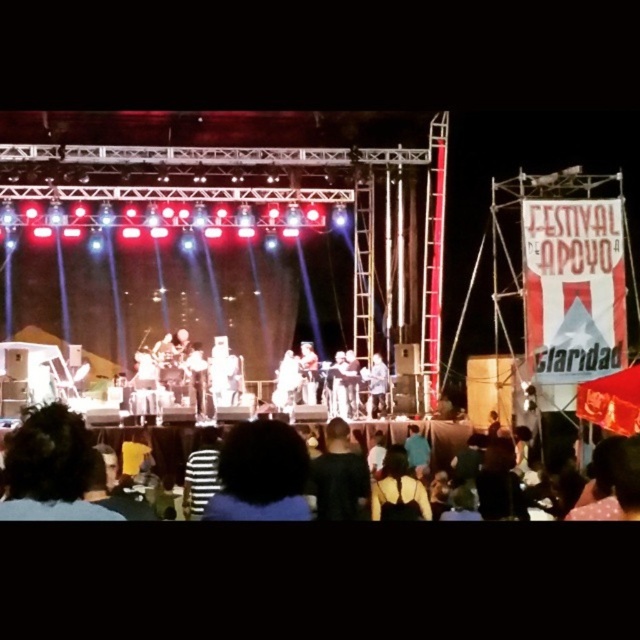
Question: Considering the relative positions of smooth skin person at center and light brown wooden guitar at center in the image provided, where is smooth skin person at center located with respect to light brown wooden guitar at center?

Choices:
 (A) left
 (B) right

Answer: (A)

Question: Can you confirm if dark hair at center is bigger than dark brown leather jacket at center?

Choices:
 (A) no
 (B) yes

Answer: (B)

Question: Does dark hair at center have a smaller size compared to white fabric at center?

Choices:
 (A) yes
 (B) no

Answer: (B)

Question: Which object is the closest to the white fabric at center?

Choices:
 (A) dark hair at center
 (B) dark brown leather jacket at center
 (C) smooth skin person at center
 (D) black matte shirt at center

Answer: (B)

Question: Which of the following is the closest to the observer?

Choices:
 (A) (244, 506)
 (B) (349, 472)

Answer: (A)

Question: Which point is closer to the camera?

Choices:
 (A) (353, 461)
 (B) (316, 365)
 (C) (380, 369)

Answer: (A)